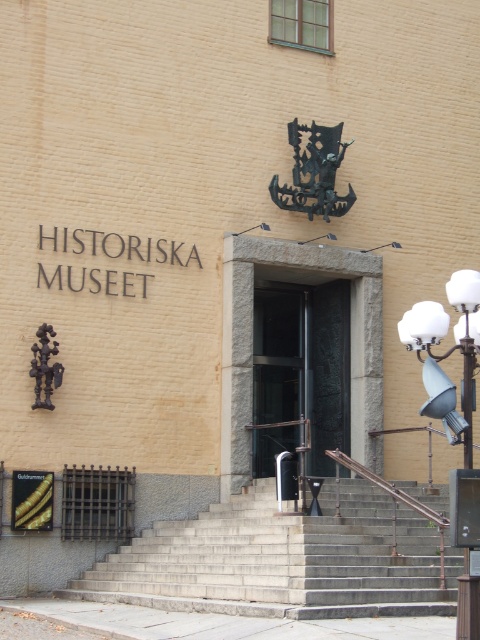
Question: Observing the image, what is the correct spatial positioning of transparent glass door at center in reference to goldmetallicsign at lower left?

Choices:
 (A) above
 (B) below

Answer: (A)

Question: Which object is farther from the camera taking this photo?

Choices:
 (A) transparent glass door at center
 (B) goldmetallicsign at lower left
 (C) gray concrete stairs at center

Answer: (A)

Question: Which object appears farthest from the camera in this image?

Choices:
 (A) transparent glass door at center
 (B) gray concrete stairs at center

Answer: (A)

Question: Is gray concrete stairs at center bigger than transparent glass door at center?

Choices:
 (A) yes
 (B) no

Answer: (A)

Question: Among these objects, which one is nearest to the camera?

Choices:
 (A) goldmetallicsign at lower left
 (B) transparent glass door at center

Answer: (A)

Question: Can you confirm if gray concrete stairs at center is positioned below goldmetallicsign at lower left?

Choices:
 (A) no
 (B) yes

Answer: (B)